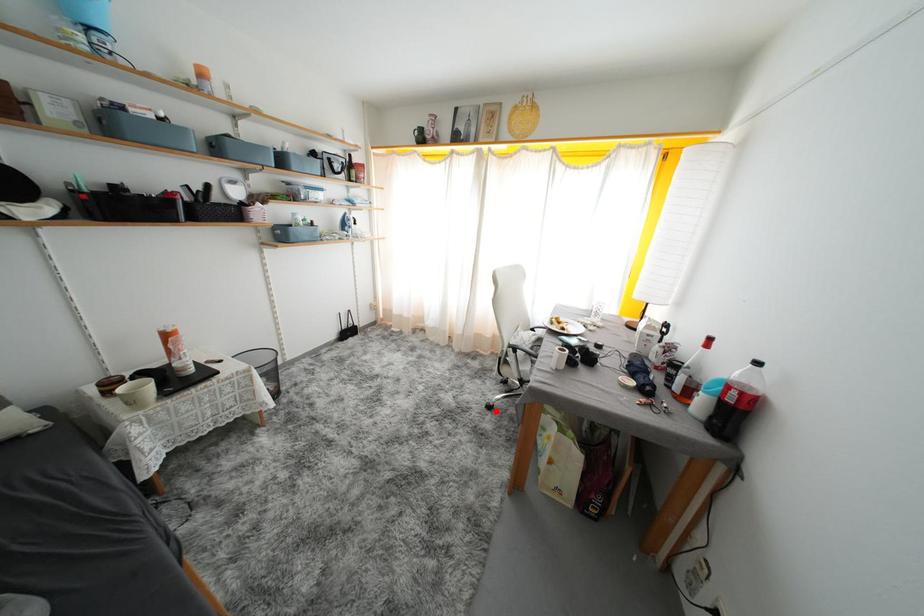
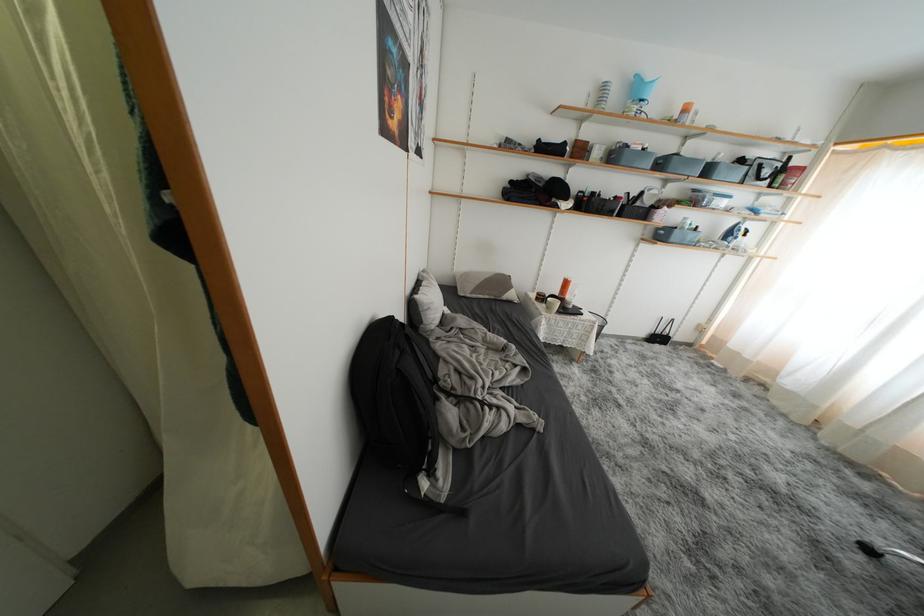
Where in the second image is the point corresponding to the highlighted location from the first image?

(876, 554)